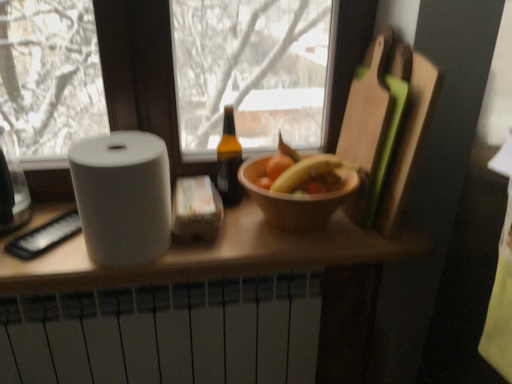
Question: Is wooden bowl at center aimed at white matte radiator at lower center?

Choices:
 (A) no
 (B) yes

Answer: (A)

Question: Is the position of wooden bowl at center more distant than that of white matte radiator at lower center?

Choices:
 (A) no
 (B) yes

Answer: (A)

Question: Is wooden bowl at center directly adjacent to white matte radiator at lower center?

Choices:
 (A) no
 (B) yes

Answer: (A)

Question: Considering the relative sizes of wooden bowl at center and white matte radiator at lower center in the image provided, is wooden bowl at center shorter than white matte radiator at lower center?

Choices:
 (A) yes
 (B) no

Answer: (A)

Question: Is wooden bowl at center outside of white matte radiator at lower center?

Choices:
 (A) no
 (B) yes

Answer: (B)

Question: Considering the positions of smooth wooden bowl at center and white matte paper towel at left in the image, is smooth wooden bowl at center wider or thinner than white matte paper towel at left?

Choices:
 (A) thin
 (B) wide

Answer: (A)

Question: Is smooth wooden bowl at center taller or shorter than white matte paper towel at left?

Choices:
 (A) tall
 (B) short

Answer: (B)

Question: Visually, is smooth wooden bowl at center positioned to the left or to the right of white matte paper towel at left?

Choices:
 (A) left
 (B) right

Answer: (B)

Question: Would you say smooth wooden bowl at center is inside or outside white matte paper towel at left?

Choices:
 (A) outside
 (B) inside

Answer: (A)

Question: In terms of size, does clear glass jar at left appear bigger or smaller than smooth wooden bowl at center?

Choices:
 (A) big
 (B) small

Answer: (A)

Question: From the image's perspective, is clear glass jar at left positioned above or below smooth wooden bowl at center?

Choices:
 (A) above
 (B) below

Answer: (B)

Question: From a real-world perspective, is clear glass jar at left physically located above or below smooth wooden bowl at center?

Choices:
 (A) below
 (B) above

Answer: (A)

Question: Considering their positions, is clear glass jar at left located in front of or behind smooth wooden bowl at center?

Choices:
 (A) front
 (B) behind

Answer: (A)

Question: Looking at their shapes, would you say brown glass bottle at center is wider or thinner than wooden bowl at center?

Choices:
 (A) thin
 (B) wide

Answer: (A)

Question: Relative to wooden bowl at center, is brown glass bottle at center in front or behind?

Choices:
 (A) front
 (B) behind

Answer: (B)